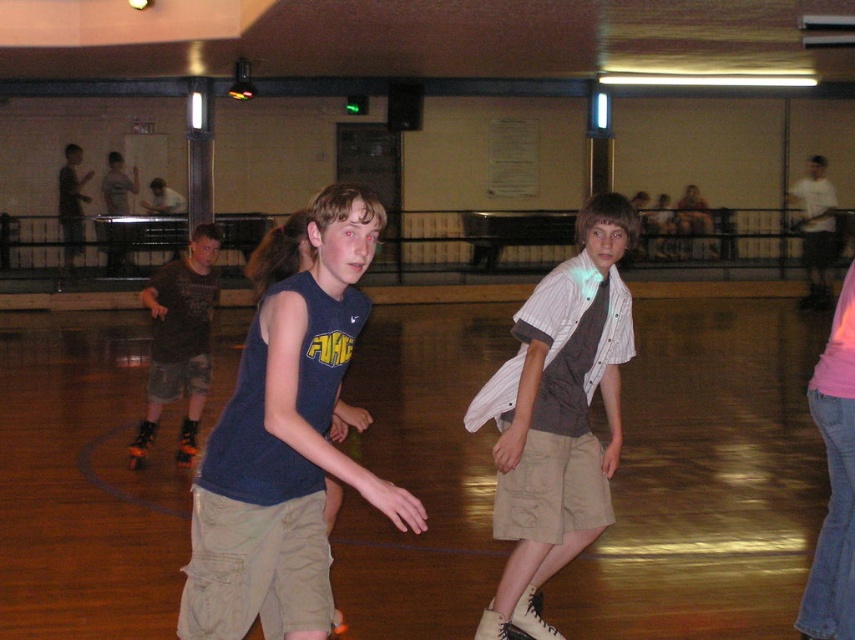
You are a visitor at the roller skating rink and you see the camouflage shorts at left and the orange roller skate at lower left. Which object is covering the other one?

The camouflage shorts at left is positioned over orange roller skate at lower left, so the camouflage shorts at left is covering the orange roller skate at lower left.

You are a photographer at the roller skating rink. You want to take a photo of the camouflage shorts at left and orange roller skate at lower left. Which object should you focus on if you want the one that appears bigger in the photo?

The camouflage shorts at left appears larger in the photo because it is larger in size than the orange roller skate at lower left.